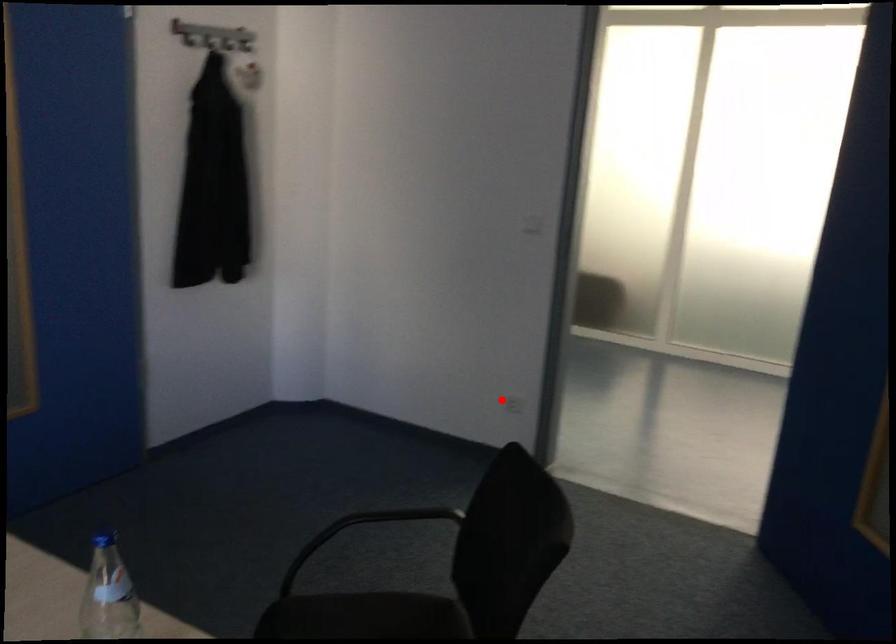
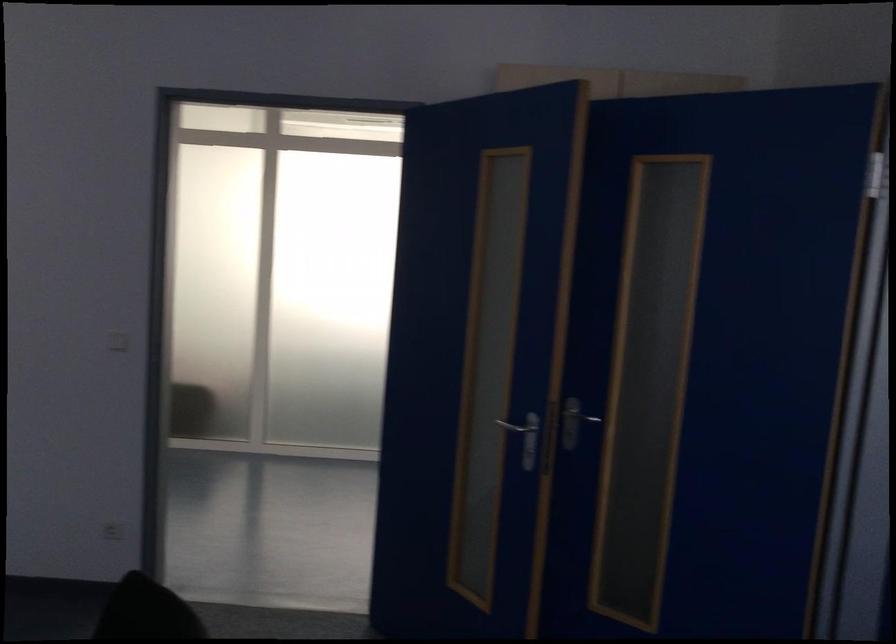
In the second image, find the point that corresponds to the highlighted location in the first image.

(112, 531)